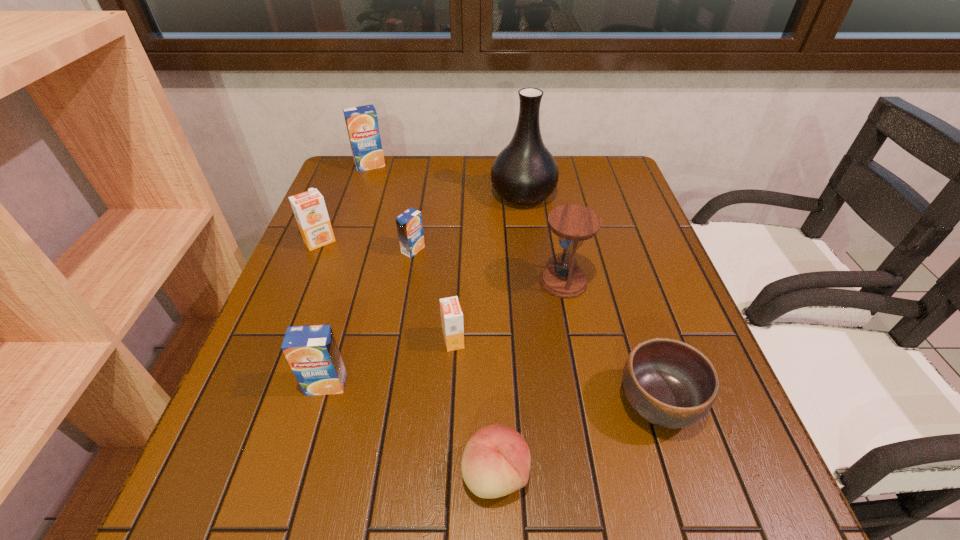
Image resolution: width=960 pixels, height=540 pixels. I want to click on the eighth nearest object, so click(525, 172).

Locate an element on the screen. Image resolution: width=960 pixels, height=540 pixels. vase is located at coordinates (525, 172).

Image resolution: width=960 pixels, height=540 pixels. What are the coordinates of `the farthest blue orange_juice` in the screenshot? It's located at (362, 125).

Where is `the biggest blue orange_juice`? the biggest blue orange_juice is located at coordinates (362, 125).

Locate an element on the screen. This screenshot has width=960, height=540. hourglass is located at coordinates (573, 224).

At what (x,y) coordinates should I click in order to perform the action: click on the nearest orange juice. Please return your answer as a coordinate pair (x, y). Image resolution: width=960 pixels, height=540 pixels. Looking at the image, I should click on (312, 352).

This screenshot has width=960, height=540. What are the coordinates of `the nearest blue orange_juice` in the screenshot? It's located at (312, 352).

The width and height of the screenshot is (960, 540). Find the location of `the left orange orange juice`. the left orange orange juice is located at coordinates (309, 208).

Where is `the bigger orange orange juice`? Image resolution: width=960 pixels, height=540 pixels. the bigger orange orange juice is located at coordinates (309, 208).

Where is `the rightmost blue orange_juice`? the rightmost blue orange_juice is located at coordinates (409, 224).